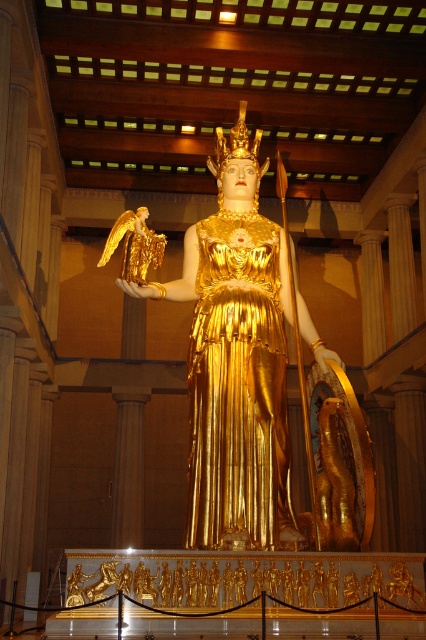
Between gold metallic angel at upper left and gold textured crown at center, which one has less height?

Standing shorter between the two is gold metallic angel at upper left.

Image resolution: width=426 pixels, height=640 pixels. What do you see at coordinates (135, 244) in the screenshot?
I see `gold metallic angel at upper left` at bounding box center [135, 244].

Does point (152, 262) come farther from viewer compared to point (218, 173)?

That is False.

You are a GUI agent. You are given a task and a screenshot of the screen. Output one action in this format:
    pyautogui.click(x=<x>, y=<y>)
    Task: Click on the gold metallic angel at upper left
    This screenshot has width=426, height=640.
    Given the screenshot: What is the action you would take?
    pyautogui.click(x=135, y=244)

Who is higher up, gold metallic dress at center or gold metallic angel at upper left?

gold metallic angel at upper left is above.

Locate an element on the screen. Image resolution: width=426 pixels, height=640 pixels. gold metallic dress at center is located at coordinates (238, 390).

From the picture: Who is positioned more to the right, goldmaterial/texturestatue at center or gold textured crown at center?

From the viewer's perspective, gold textured crown at center appears more on the right side.

Can you confirm if goldmaterial/texturestatue at center is taller than gold textured crown at center?

Yes.

Locate an element on the screen. This screenshot has height=640, width=426. goldmaterial/texturestatue at center is located at coordinates (236, 369).

Where is `goldmaterial/texturestatue at center`? Image resolution: width=426 pixels, height=640 pixels. goldmaterial/texturestatue at center is located at coordinates (236, 369).